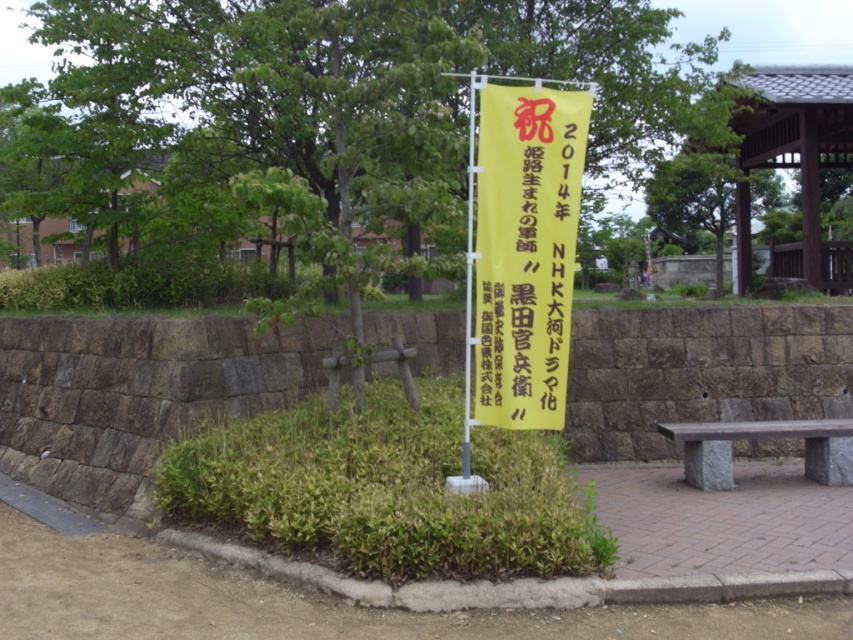
Between green leafy tree at center and wooden bench at right, which one is positioned higher?

green leafy tree at center

Is green leafy tree at center smaller than wooden bench at right?

Incorrect, green leafy tree at center is not smaller in size than wooden bench at right.

Measure the distance between green leafy tree at center and camera.

green leafy tree at center is 21.77 feet from camera.

You are a GUI agent. You are given a task and a screenshot of the screen. Output one action in this format:
    pyautogui.click(x=<x>, y=<y>)
    Task: Click on the green leafy tree at center
    The width and height of the screenshot is (853, 640).
    Given the screenshot: What is the action you would take?
    pyautogui.click(x=363, y=83)

Between point (524, 116) and point (781, 433), which one is positioned in front?

Point (524, 116)

Between point (567, 321) and point (822, 456), which one is positioned in front?

Point (567, 321) is more forward.

I want to click on yellow paper banner at center, so click(x=525, y=252).

Consider the image. Is green leafy tree at center below yellow paper banner at center?

Incorrect, green leafy tree at center is not positioned below yellow paper banner at center.

Who is more distant from viewer, (408, 45) or (483, 205)?

The point (408, 45) is more distant.

Where is `green leafy tree at center`? green leafy tree at center is located at coordinates (363, 83).

Image resolution: width=853 pixels, height=640 pixels. I want to click on green leafy tree at center, so click(363, 83).